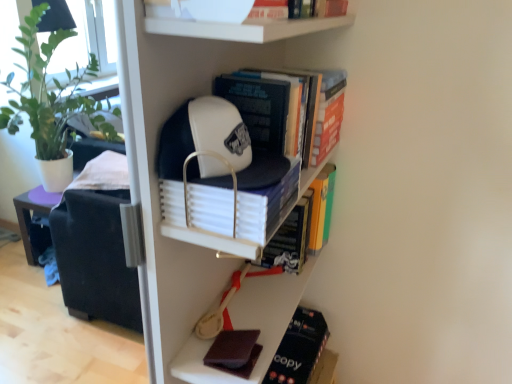
Question: From a real-world perspective, is dark brown matte book at lower center positioned above or below white matte baseball cap at upper center?

Choices:
 (A) above
 (B) below

Answer: (A)

Question: From their relative heights in the image, would you say dark brown matte book at lower center is taller or shorter than white matte baseball cap at upper center?

Choices:
 (A) short
 (B) tall

Answer: (A)

Question: Which object is the closest to the white matte bowl at upper center, the 1th book viewed from the top?

Choices:
 (A) white matte book at center, positioned as the 4th book in top-to-bottom order
 (B) hardcover book at center, which is the third book from top to bottom
 (C) orange matte book at upper right, the 2th book when ordered from top to bottom
 (D) dark brown matte book at lower center
 (E) white matte baseball cap at upper center

Answer: (A)

Question: Which is nearer to the hardcover book at center, which is the fourth book in bottom-to-top order?

Choices:
 (A) orange matte book at upper right, positioned as the fifth book in bottom-to-top order
 (B) hardcover book at center, the 5th book when ordered from top to bottom
 (C) white matte book at center, positioned as the 4th book in top-to-bottom order
 (D) dark brown leather book at lower right, acting as the first book starting from the bottom
 (E) white matte baseball cap at upper center

Answer: (A)